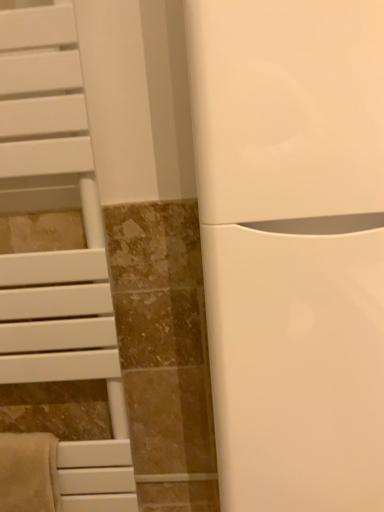
In the scene shown: What is the approximate height of white matte towel rack at left?

The height of white matte towel rack at left is 4.20 feet.

At what (x,y) coordinates should I click in order to perform the action: click on white glossy toilet at center. Please return your answer as a coordinate pair (x, y). Looking at the image, I should click on [292, 246].

Considering the relative positions of white glossy toilet at center and white matte towel rack at left in the image provided, is white glossy toilet at center to the right of white matte towel rack at left from the viewer's perspective?

Yes.

From a real-world perspective, does white glossy toilet at center sit lower than white matte towel rack at left?

Incorrect, from a real-world perspective, white glossy toilet at center is higher than white matte towel rack at left.

From the image's perspective, is white glossy toilet at center located above white matte towel rack at left?

Yes, from the image's perspective, white glossy toilet at center is above white matte towel rack at left.

Which object is closer to the camera, white glossy toilet at center or beige soft towel at lower left?

white glossy toilet at center is more forward.

Is white glossy toilet at center smaller than beige soft towel at lower left?

No.

Is white glossy toilet at center inside or outside of beige soft towel at lower left?

white glossy toilet at center is not enclosed by beige soft towel at lower left.

Considering the positions of point (352, 216) and point (54, 450), is point (352, 216) closer or farther from the camera than point (54, 450)?

Point (352, 216) is closer to the camera than point (54, 450).

Is white matte towel rack at left oriented towards white glossy toilet at center?

No.

From a real-world perspective, between white matte towel rack at left and white glossy toilet at center, who is vertically higher?

From a 3D spatial view, white glossy toilet at center is above.

Between white matte towel rack at left and white glossy toilet at center, which one has smaller size?

white matte towel rack at left.

Is white matte towel rack at left aimed at beige soft towel at lower left?

Yes.

Considering the sizes of objects white matte towel rack at left and beige soft towel at lower left in the image provided, who is smaller, white matte towel rack at left or beige soft towel at lower left?

With smaller size is beige soft towel at lower left.

Is white matte towel rack at left not close to beige soft towel at lower left?

They are positioned close to each other.

Is beige soft towel at lower left wider than white glossy toilet at center?

Incorrect, the width of beige soft towel at lower left does not surpass that of white glossy toilet at center.

Is point (14, 497) positioned after point (287, 467)?

Yes, it is behind point (287, 467).

Is the depth of beige soft towel at lower left greater than that of white glossy toilet at center?

Yes, the depth of beige soft towel at lower left is greater than that of white glossy toilet at center.

Which of these two, beige soft towel at lower left or white glossy toilet at center, is bigger?

Bigger between the two is white glossy toilet at center.

Which of these two, beige soft towel at lower left or white matte towel rack at left, is bigger?

white matte towel rack at left is bigger.

Do you think beige soft towel at lower left is within white matte towel rack at left, or outside of it?

beige soft towel at lower left is enclosed within white matte towel rack at left.

From a real-world perspective, which is physically below, beige soft towel at lower left or white matte towel rack at left?

beige soft towel at lower left.

Consider the image. From their relative heights in the image, would you say beige soft towel at lower left is taller or shorter than white matte towel rack at left?

Clearly, beige soft towel at lower left is shorter compared to white matte towel rack at left.

The image size is (384, 512). What are the coordinates of `appliance above the white matte towel rack at left (from a real-world perspective)` in the screenshot? It's located at (292, 246).

Identify the location of appliance on the right of beige soft towel at lower left. (292, 246).

Estimate the real-world distances between objects in this image. Which object is closer to white glossy toilet at center, beige soft towel at lower left or white matte towel rack at left?

white matte towel rack at left is closer to white glossy toilet at center.

From the image, which object appears to be nearer to white matte towel rack at left, beige soft towel at lower left or white glossy toilet at center?

beige soft towel at lower left lies closer to white matte towel rack at left than the other object.

When comparing their distances from beige soft towel at lower left, does white matte towel rack at left or white glossy toilet at center seem further?

white glossy toilet at center lies further to beige soft towel at lower left than the other object.

Which object lies further to the anchor point white glossy toilet at center, white matte towel rack at left or beige soft towel at lower left?

beige soft towel at lower left is further to white glossy toilet at center.

Considering their positions, is white glossy toilet at center positioned closer to beige soft towel at lower left than white matte towel rack at left?

Among the two, white matte towel rack at left is located nearer to beige soft towel at lower left.

Looking at the image, which one is located further to white matte towel rack at left, white glossy toilet at center or beige soft towel at lower left?

white glossy toilet at center is positioned further to the anchor white matte towel rack at left.

Find the location of a particular element. furniture located between beige soft towel at lower left and white glossy toilet at center in the left-right direction is located at coordinates (58, 251).